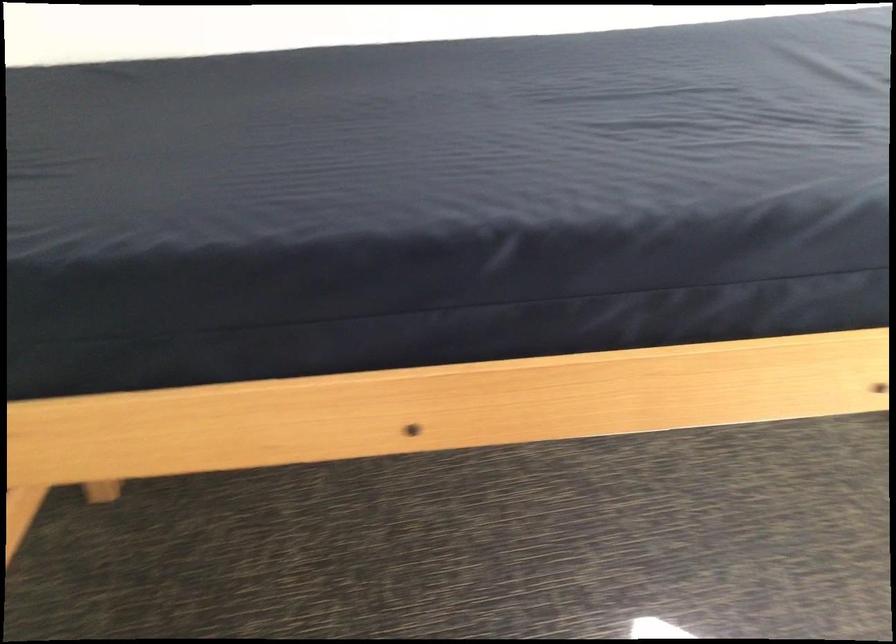
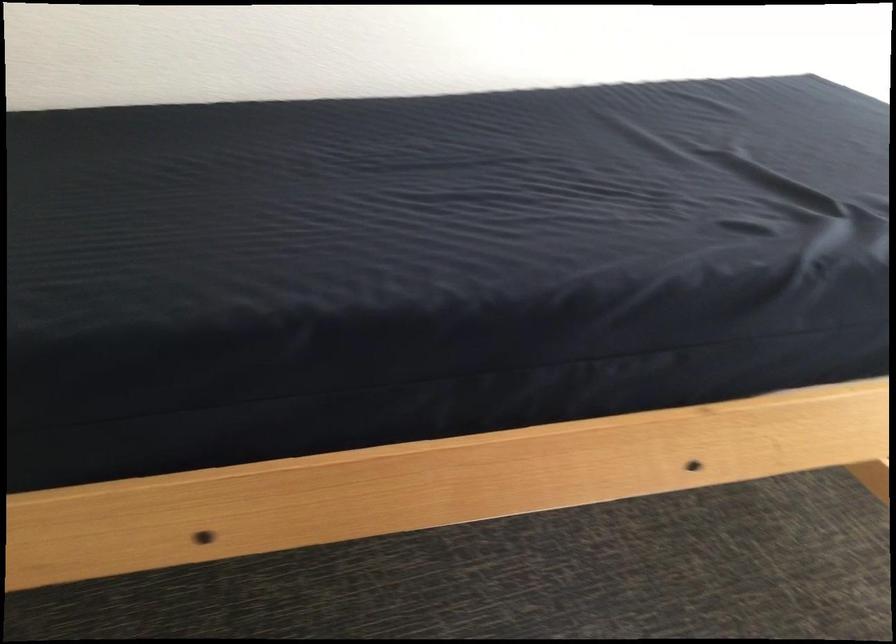
Which direction would the cameraman need to move to produce the second image?

The cameraman walked toward right, forward.